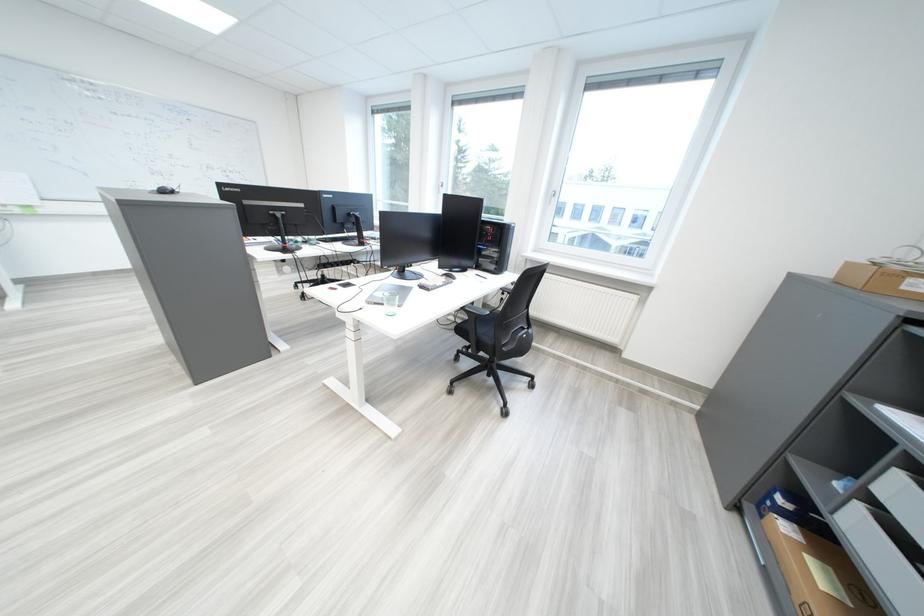
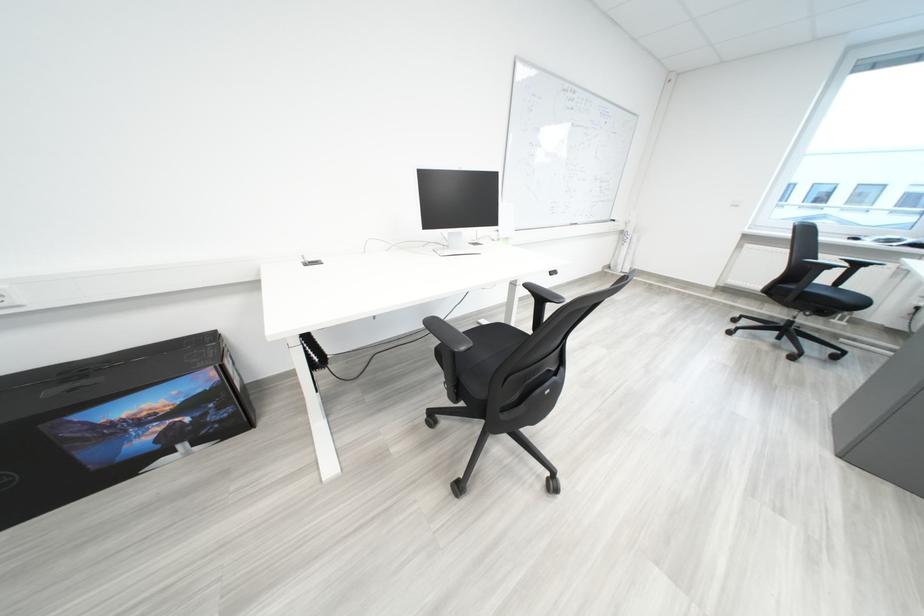
Question: Which direction would the cameraman need to move to produce the second image? Reply with the corresponding letter.

Choices:
 (A) Left
 (B) Right
 (C) Forward
 (D) Backward

Answer: (A)